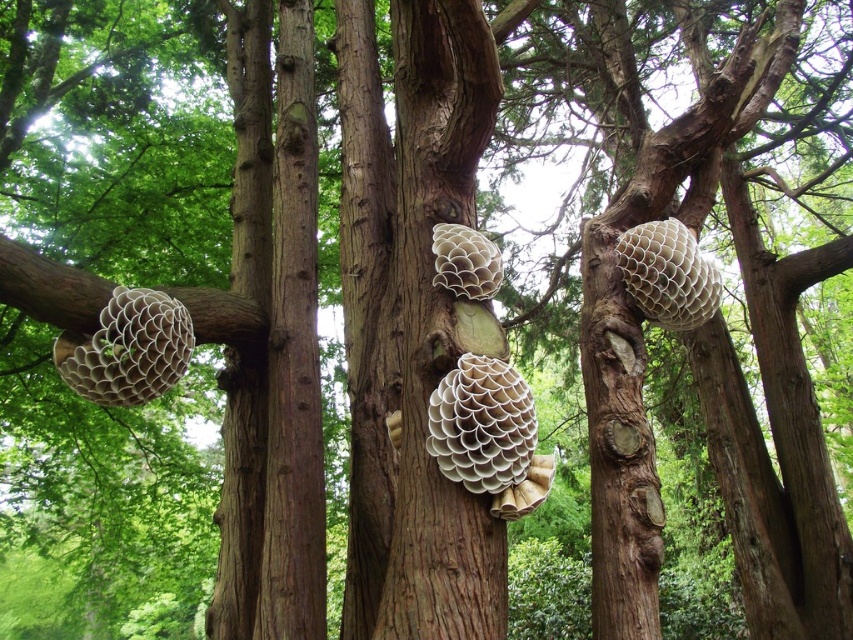
Question: Does brown rough tree trunk at center appear on the right side of white honeycomb beehive at upper right?

Choices:
 (A) no
 (B) yes

Answer: (A)

Question: Based on their relative distances, which object is farther from the white honeycomb beehive at upper right?

Choices:
 (A) white textured beehive at center
 (B) white honeycomb beehive at center
 (C) white matte beehive at left

Answer: (C)

Question: Among these objects, which one is farthest from the camera?

Choices:
 (A) white textured beehive at center
 (B) brown rough tree trunk at center
 (C) white honeycomb beehive at center
 (D) white matte beehive at left

Answer: (C)

Question: Does brown rough tree trunk at center appear on the left side of white honeycomb beehive at center?

Choices:
 (A) no
 (B) yes

Answer: (B)

Question: Among these objects, which one is nearest to the camera?

Choices:
 (A) white honeycomb beehive at upper right
 (B) white textured beehive at center
 (C) brown rough tree trunk at center

Answer: (C)

Question: Does white matte beehive at left appear under white honeycomb beehive at center?

Choices:
 (A) no
 (B) yes

Answer: (B)